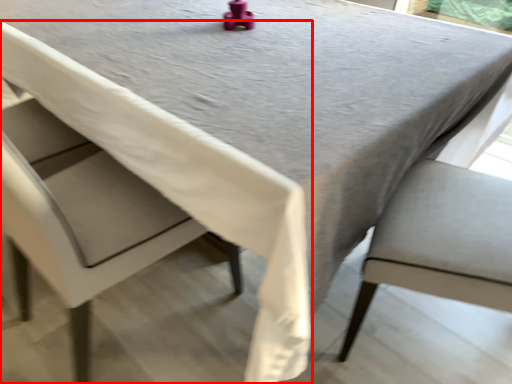
Question: In this image, where is chair (annotated by the red box) located relative to chair?

Choices:
 (A) right
 (B) left

Answer: (B)